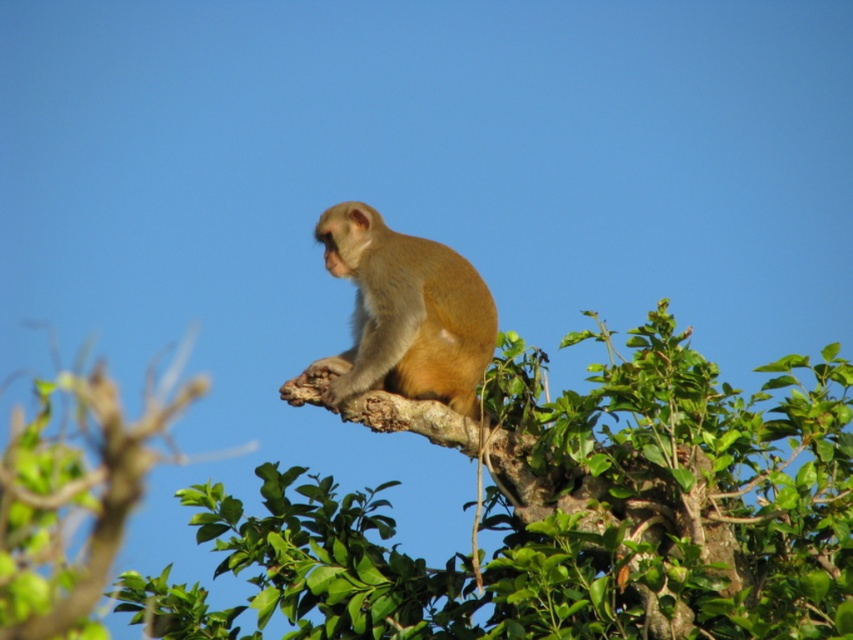
Question: Can you confirm if green leafy tree at upper center is thinner than golden fur monkey at upper center?

Choices:
 (A) yes
 (B) no

Answer: (B)

Question: Can you confirm if green leafy tree at upper center is bigger than golden fur monkey at upper center?

Choices:
 (A) yes
 (B) no

Answer: (A)

Question: Among these points, which one is farthest from the camera?

Choices:
 (A) (595, 339)
 (B) (453, 294)

Answer: (B)

Question: Does green leafy tree at upper center appear on the right side of golden fur monkey at upper center?

Choices:
 (A) no
 (B) yes

Answer: (B)

Question: Among these points, which one is farthest from the camera?

Choices:
 (A) (432, 252)
 (B) (735, 396)

Answer: (A)

Question: Which point is closer to the camera taking this photo?

Choices:
 (A) (428, 362)
 (B) (782, 458)

Answer: (B)